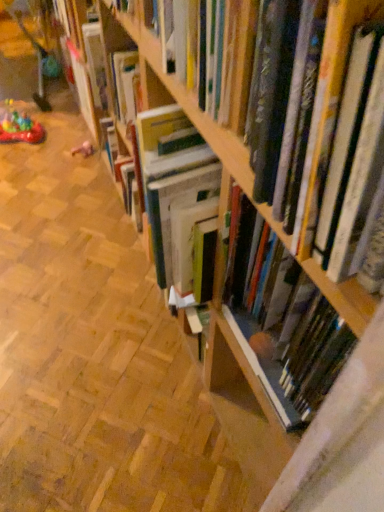
What do you see at coordinates (83, 149) in the screenshot? The width and height of the screenshot is (384, 512). I see `pink fabric toy at lower left, acting as the 1th toy starting from the right` at bounding box center [83, 149].

What do you see at coordinates (19, 126) in the screenshot? I see `translucent plastic toy at lower left, which ranks as the first toy in left-to-right order` at bounding box center [19, 126].

Measure the distance between translucent plastic toy at lower left, the 2th toy when ordered from right to left, and camera.

1.98 meters.

Locate an element on the screen. hardcover book at center, the 2th book viewed from the front is located at coordinates (282, 322).

Locate an element on the screen. Image resolution: width=384 pixels, height=512 pixels. hardcover book at center, marked as the 1th book in a front-to-back arrangement is located at coordinates (191, 105).

Looking at this image, is the position of hardcover book at center, arranged as the 1th book when viewed from the back, less distant than that of pink fabric toy at lower left, acting as the 1th toy starting from the right?

Yes, hardcover book at center, arranged as the 1th book when viewed from the back, is closer to the camera.

Considering the sizes of objects hardcover book at center, arranged as the 1th book when viewed from the back, and pink fabric toy at lower left, which ranks as the 2th toy in left-to-right order, in the image provided, who is bigger, hardcover book at center, arranged as the 1th book when viewed from the back, or pink fabric toy at lower left, which ranks as the 2th toy in left-to-right order,?

With larger size is hardcover book at center, arranged as the 1th book when viewed from the back.

Is hardcover book at center, arranged as the 1th book when viewed from the back, turned away from pink fabric toy at lower left, acting as the 1th toy starting from the right?

No, hardcover book at center, arranged as the 1th book when viewed from the back, is not facing the opposite direction of pink fabric toy at lower left, acting as the 1th toy starting from the right.

Is hardcover book at center, the 2th book viewed from the front, at the left side of pink fabric toy at lower left, acting as the 1th toy starting from the right?

In fact, hardcover book at center, the 2th book viewed from the front, is to the right of pink fabric toy at lower left, acting as the 1th toy starting from the right.

Is wooden bookshelf at center turned away from hardcover book at center, the 2th book viewed from the front?

No.

Would you say wooden bookshelf at center is to the left or to the right of hardcover book at center, the 2th book viewed from the front, in the picture?

Clearly, wooden bookshelf at center is on the left of hardcover book at center, the 2th book viewed from the front, in the image.

Which is in front, wooden bookshelf at center or hardcover book at center, the 2th book viewed from the front?

Positioned in front is hardcover book at center, the 2th book viewed from the front.

From the image's perspective, relative to hardcover book at center, the 2th book viewed from the front, is wooden bookshelf at center above or below?

Based on their image positions, wooden bookshelf at center is located above hardcover book at center, the 2th book viewed from the front.

From the image's perspective, relative to translucent plastic toy at lower left, which ranks as the first toy in left-to-right order, is wooden bookshelf at center above or below?

wooden bookshelf at center is situated lower than translucent plastic toy at lower left, which ranks as the first toy in left-to-right order, in the image.

Based on the photo, does wooden bookshelf at center have a lesser width compared to translucent plastic toy at lower left, which ranks as the first toy in left-to-right order?

No.

Looking at the image, does wooden bookshelf at center seem bigger or smaller compared to translucent plastic toy at lower left, which ranks as the first toy in left-to-right order?

Considering their sizes, wooden bookshelf at center takes up more space than translucent plastic toy at lower left, which ranks as the first toy in left-to-right order.

From the image's perspective, is hardcover book at center, which appears as the second book when viewed from the back, located above hardcover book at center, the 2th book viewed from the front?

Indeed, from the image's perspective, hardcover book at center, which appears as the second book when viewed from the back, is shown above hardcover book at center, the 2th book viewed from the front.

Is point (316, 158) in front of point (267, 370)?

That is True.

Identify the location of book to the right of hardcover book at center, which appears as the second book when viewed from the back. (282, 322).

Is hardcover book at center, marked as the 1th book in a front-to-back arrangement, in contact with hardcover book at center, the 2th book viewed from the front?

hardcover book at center, marked as the 1th book in a front-to-back arrangement, and hardcover book at center, the 2th book viewed from the front, are clearly separated.

Does point (283, 290) come behind point (124, 19)?

That is False.

Identify the location of book lying on the left of hardcover book at center, the 2th book viewed from the front. This screenshot has width=384, height=512. (191, 105).

From a real-world perspective, relative to hardcover book at center, marked as the 1th book in a front-to-back arrangement, is hardcover book at center, the 2th book viewed from the front, vertically above or below?

From a real-world perspective, hardcover book at center, the 2th book viewed from the front, is physically below hardcover book at center, marked as the 1th book in a front-to-back arrangement.

Is hardcover book at center, the 2th book viewed from the front, far away from hardcover book at center, marked as the 1th book in a front-to-back arrangement?

Answer: hardcover book at center, the 2th book viewed from the front, is near hardcover book at center, marked as the 1th book in a front-to-back arrangement, not far away.

Based on the photo, is pink fabric toy at lower left, which ranks as the 2th toy in left-to-right order, inside the boundaries of wooden bookshelf at center, or outside?

The correct answer is: inside.

Locate an element on the screen. toy that is the 1st object above the wooden bookshelf at center (from a real-world perspective) is located at coordinates (83, 149).

Would you say pink fabric toy at lower left, acting as the 1th toy starting from the right, is to the left or to the right of wooden bookshelf at center in the picture?

In the image, pink fabric toy at lower left, acting as the 1th toy starting from the right, appears on the left side of wooden bookshelf at center.

Is pink fabric toy at lower left, acting as the 1th toy starting from the right, in front of or behind wooden bookshelf at center in the image?

pink fabric toy at lower left, acting as the 1th toy starting from the right, is behind wooden bookshelf at center.

Which of these two, pink fabric toy at lower left, acting as the 1th toy starting from the right, or hardcover book at center, the 2th book viewed from the front, is bigger?

hardcover book at center, the 2th book viewed from the front, is bigger.

Where is `the 2nd book below the pink fabric toy at lower left, acting as the 1th toy starting from the right (from the image's perspective)`? the 2nd book below the pink fabric toy at lower left, acting as the 1th toy starting from the right (from the image's perspective) is located at coordinates (282, 322).

Can you see pink fabric toy at lower left, acting as the 1th toy starting from the right, touching hardcover book at center, arranged as the 1th book when viewed from the back?

No, pink fabric toy at lower left, acting as the 1th toy starting from the right, is not next to hardcover book at center, arranged as the 1th book when viewed from the back.

From a real-world perspective, count 2nd toys downward from the hardcover book at center, arranged as the 1th book when viewed from the back, and point to it. Please provide its 2D coordinates.

[(83, 149)]

In the image, there is a wooden bookshelf at center. Identify the location of book below it (from the image's perspective). coord(282,322).

When comparing their distances from hardcover book at center, the 2th book viewed from the front, does wooden bookshelf at center or translucent plastic toy at lower left, the 2th toy when ordered from right to left, seem closer?

Among the two, wooden bookshelf at center is located nearer to hardcover book at center, the 2th book viewed from the front.

Based on their spatial positions, is hardcover book at center, the 2th book viewed from the front, or wooden bookshelf at center closer to hardcover book at center, marked as the 1th book in a front-to-back arrangement?

hardcover book at center, the 2th book viewed from the front, is positioned closer to the anchor hardcover book at center, marked as the 1th book in a front-to-back arrangement.

When comparing their distances from wooden bookshelf at center, does pink fabric toy at lower left, acting as the 1th toy starting from the right, or hardcover book at center, the 2th book viewed from the front, seem closer?

Based on the image, hardcover book at center, the 2th book viewed from the front, appears to be nearer to wooden bookshelf at center.

Considering their positions, is translucent plastic toy at lower left, which ranks as the first toy in left-to-right order, positioned closer to hardcover book at center, the 2th book viewed from the front, than hardcover book at center, which appears as the second book when viewed from the back?

hardcover book at center, which appears as the second book when viewed from the back, lies closer to hardcover book at center, the 2th book viewed from the front, than the other object.

When comparing their distances from hardcover book at center, which appears as the second book when viewed from the back, does wooden bookshelf at center or pink fabric toy at lower left, acting as the 1th toy starting from the right, seem further?

pink fabric toy at lower left, acting as the 1th toy starting from the right, is positioned further to the anchor hardcover book at center, which appears as the second book when viewed from the back.

From the image, which object appears to be farther from wooden bookshelf at center, translucent plastic toy at lower left, which ranks as the first toy in left-to-right order, or hardcover book at center, marked as the 1th book in a front-to-back arrangement?

translucent plastic toy at lower left, which ranks as the first toy in left-to-right order, is further to wooden bookshelf at center.

Based on their spatial positions, is hardcover book at center, the 2th book viewed from the front, or pink fabric toy at lower left, which ranks as the 2th toy in left-to-right order, closer to hardcover book at center, marked as the 1th book in a front-to-back arrangement?

Among the two, hardcover book at center, the 2th book viewed from the front, is located nearer to hardcover book at center, marked as the 1th book in a front-to-back arrangement.

Which object lies further to the anchor point pink fabric toy at lower left, which ranks as the 2th toy in left-to-right order, hardcover book at center, which appears as the second book when viewed from the back, or wooden bookshelf at center?

hardcover book at center, which appears as the second book when viewed from the back.

Where is `book located between hardcover book at center, marked as the 1th book in a front-to-back arrangement, and pink fabric toy at lower left, which ranks as the 2th toy in left-to-right order, in the depth direction`? The height and width of the screenshot is (512, 384). book located between hardcover book at center, marked as the 1th book in a front-to-back arrangement, and pink fabric toy at lower left, which ranks as the 2th toy in left-to-right order, in the depth direction is located at coordinates (282, 322).

Identify the location of aisle between hardcover book at center, the 2th book viewed from the front, and pink fabric toy at lower left, which ranks as the 2th toy in left-to-right order, from front to back. (93, 353).

The height and width of the screenshot is (512, 384). In order to click on toy between hardcover book at center, arranged as the 1th book when viewed from the back, and pink fabric toy at lower left, acting as the 1th toy starting from the right, along the z-axis in this screenshot , I will do `click(19, 126)`.

Identify the location of book between hardcover book at center, which appears as the second book when viewed from the back, and translucent plastic toy at lower left, which ranks as the first toy in left-to-right order, along the z-axis. The height and width of the screenshot is (512, 384). (282, 322).